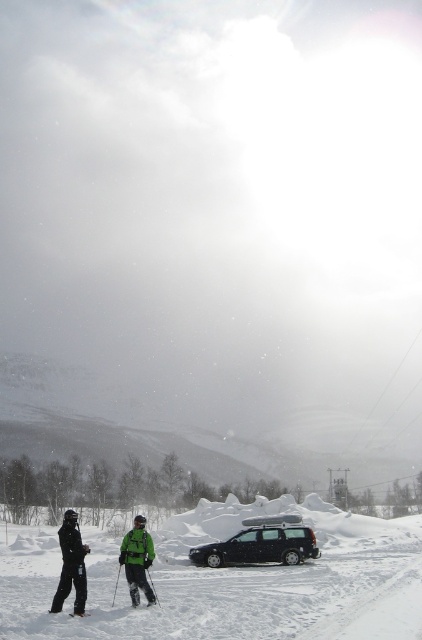
You are planning to take a photo of the black ski suit at lower center while standing at the point marked as point (x=72, y=563). Is the black ski suit at lower center visible from that location?

The black ski suit at lower center is located at point (x=72, y=563), so standing there would mean you are at the same location as the black ski suit at lower center. Therefore, you would be able to see it directly from that point.

You are a photographer trying to capture a clear shot of the black matte ski at lower center. However, the green fabric jacket at lower center is blocking your view. Can you move the jacket to get a better angle, or is there another way to adjust your position to see the ski without moving the jacket?

The black matte ski at lower center is behind the green fabric jacket at lower center, so you can either move the jacket or position yourself around it to get an unobstructed view of the ski.

You are standing at the point marked as point (137,561) in the image. Looking around, you see a green fabric jacket at lower center and a black car parked on a snow road. Which object is closer to you?

The point (137,561) is on the green fabric jacket at lower center, so the green fabric jacket at lower center is closer to you than the black car parked on a snow road.